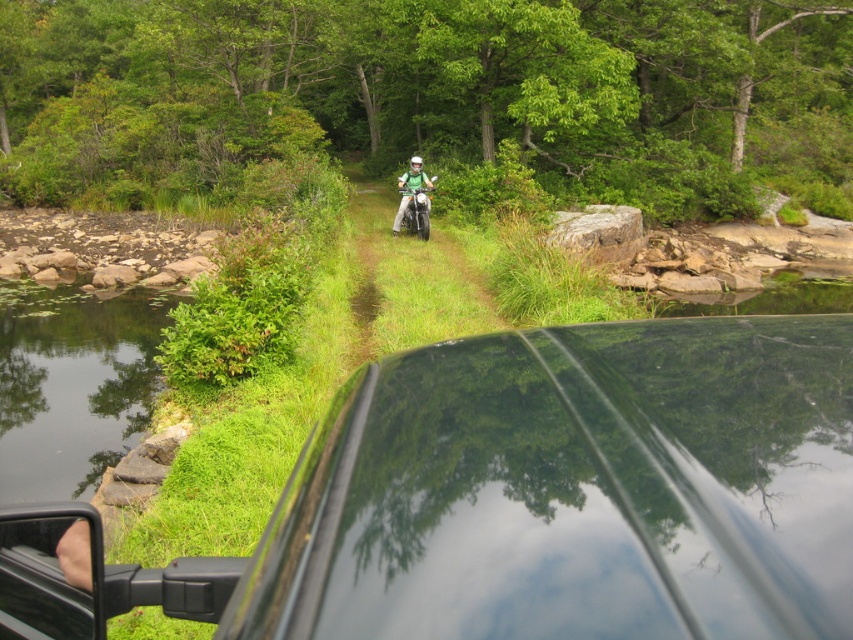
You are a passenger in the glossy black car at center and want to know if you can stand up inside the car without hitting your head on the roof. The green matte motorcycle at center is 2 meters tall. Can you stand up?

The glossy black car at center is not as tall as the green matte motorcycle at center, which is 2 meters tall. Since the car is shorter than the motorcycle, the car is less than 2 meters tall. Therefore, if the car is shorter than 2 meters, standing up might be possible but depends on the passenger height. However, since the motorcycle is taller, the car roof is lower, so the passenger might hit their head when standing.

You are sitting inside a vehicle and want to exit to the forest path. The glossy black car at center is your current location. Is there enough space between you and the forest path to open the car door?

The distance between the glossy black car at center and the viewer is 25.18 inches. Since the average car door width is about 24 inches, there is sufficient space to open the door.

You are driving a car and see two points on the path ahead. The first point is at coordinates point [502,552] and the second is at point [402,221]. Which point is closer to your car?

Point [502,552] is closer to the camera than point [402,221], so the first point is closer to your car.